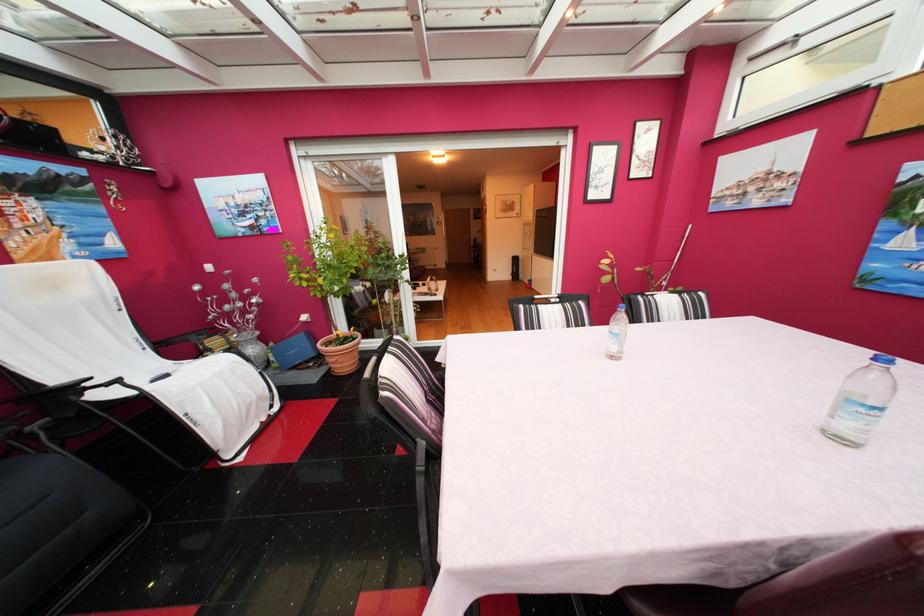
Locate an element on the screen. silver decorative vase is located at coordinates (250, 346).